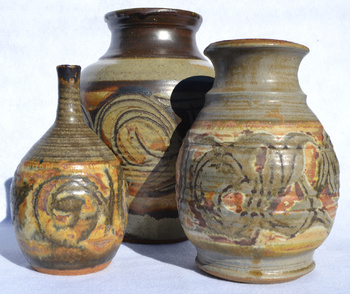
Image resolution: width=350 pixels, height=294 pixels. What are the coordinates of `biggest clay pot` in the screenshot? It's located at (167, 141).